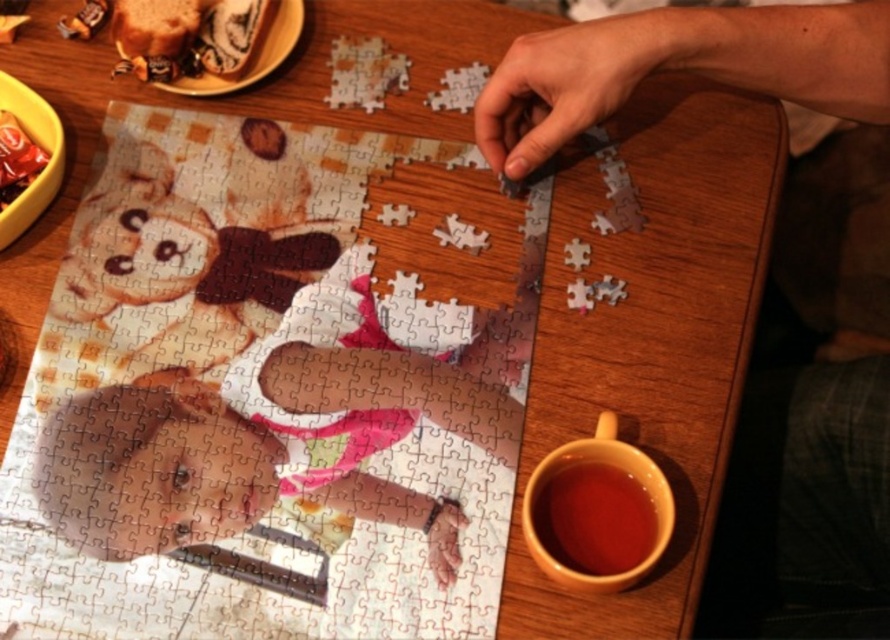
Is smooth skin hand at upper right bigger than matte plastic hand at center?

Indeed, smooth skin hand at upper right has a larger size compared to matte plastic hand at center.

The width and height of the screenshot is (890, 640). What are the coordinates of `smooth skin hand at upper right` in the screenshot? It's located at (567, 84).

Between point (227, 451) and point (630, 538), which one is positioned behind?

The point (227, 451) is more distant.

Find the location of `smooth plastic baby at center`. smooth plastic baby at center is located at coordinates (261, 433).

How far apart are smooth wooden table at center and smooth plastic baby at center?

They are 12.60 inches apart.

From the picture: Does smooth wooden table at center appear under smooth plastic baby at center?

Yes, smooth wooden table at center is below smooth plastic baby at center.

What do you see at coordinates (805, 508) in the screenshot?
I see `smooth wooden table at center` at bounding box center [805, 508].

Find the location of `smooth wooden table at center`. smooth wooden table at center is located at coordinates (805, 508).